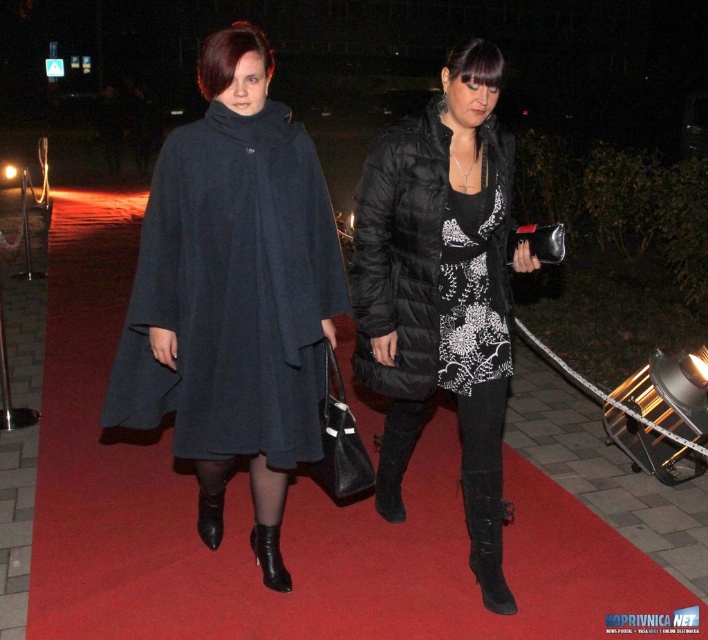
Question: Does matte black cape at center have a greater width compared to suede black boot at lower center?

Choices:
 (A) yes
 (B) no

Answer: (A)

Question: Among these objects, which one is farthest from the camera?

Choices:
 (A) black printed dress at center
 (B) black suede boot at lower center
 (C) matte black cape at center
 (D) black quilted coat at center

Answer: (B)

Question: Can you confirm if black quilted coat at center is positioned to the left of black printed dress at center?

Choices:
 (A) yes
 (B) no

Answer: (A)

Question: Does matte black coat at center have a greater width compared to suede black boot at lower center?

Choices:
 (A) no
 (B) yes

Answer: (B)

Question: Which object appears closest to the camera in this image?

Choices:
 (A) black leather boot at lower center
 (B) black suede boot at lower center
 (C) black printed dress at center

Answer: (C)

Question: Which point is farther from the camera taking this photo?

Choices:
 (A) (188, 145)
 (B) (501, 250)

Answer: (B)